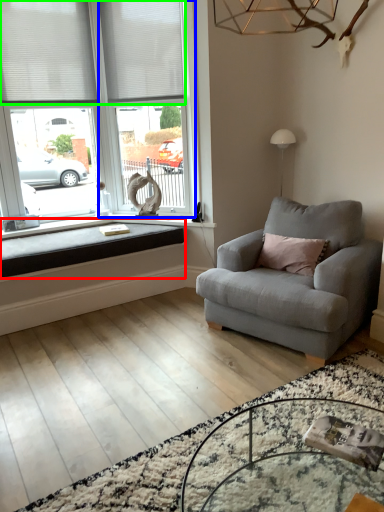
Question: Considering the real-world distances, which object is closest to window sill (highlighted by a red box)? window frame (highlighted by a blue box) or blind (highlighted by a green box).

Choices:
 (A) window frame
 (B) blind

Answer: (A)